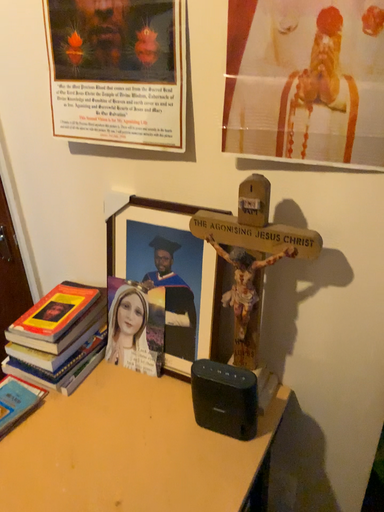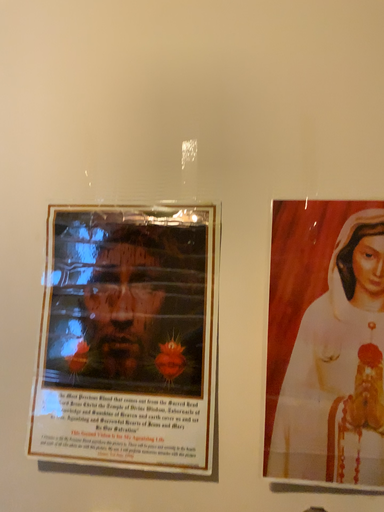
Question: Which way did the camera rotate in the video?

Choices:
 (A) rotated downward
 (B) rotated upward

Answer: (B)